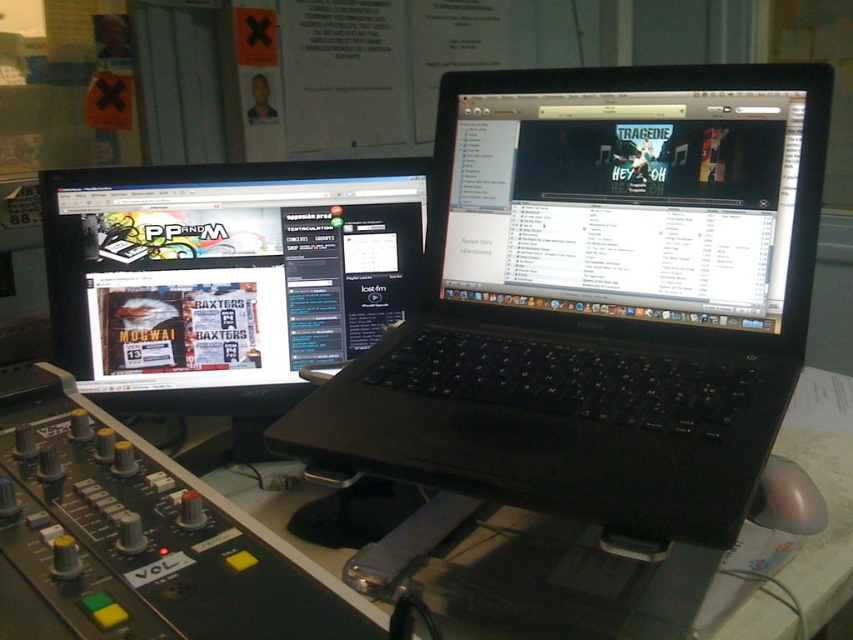
You are setting up a new monitor on your desk and need to place it near the black matte laptop at upper center. Based on the coordinates provided, where should you position the new monitor to ensure it is aligned with the laptop?

The black matte laptop at upper center is located at coordinates point (x=599, y=300), so positioning the new monitor near these coordinates would ensure proper alignment.

You are setting up a dual monitor setup and need to place the matte black monitor at left and the black glossy laptop at upper center on a desk. Which one should you place first if you want the larger screen to be on the left side?

The matte black monitor at left is larger than the black glossy laptop at upper center, so you should place the matte black monitor at left first to ensure the larger screen is on the left side.